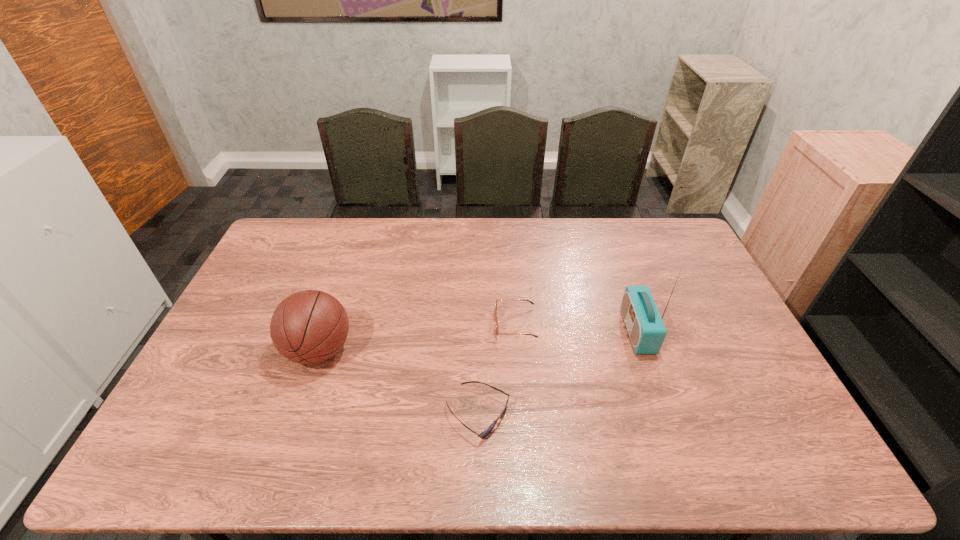
Where is `the rightmost object`? the rightmost object is located at coordinates (644, 324).

Identify the location of the tallest object. (644, 324).

The image size is (960, 540). Identify the location of the third shortest object. (308, 327).

The image size is (960, 540). What are the coordinates of `basketball` in the screenshot? It's located at (308, 327).

Locate an element on the screen. the taller sunglasses is located at coordinates (497, 329).

Locate an element on the screen. The image size is (960, 540). the third tallest object is located at coordinates (497, 329).

Locate an element on the screen. Image resolution: width=960 pixels, height=540 pixels. the shorter sunglasses is located at coordinates (482, 435).

Locate an element on the screen. the shortest object is located at coordinates (482, 435).

Where is `vacant region located 0.250m on the front panel of the radio receiver`? The image size is (960, 540). vacant region located 0.250m on the front panel of the radio receiver is located at coordinates (542, 331).

The image size is (960, 540). Identify the location of vacant space located 0.290m on the front panel of the radio receiver. (529, 331).